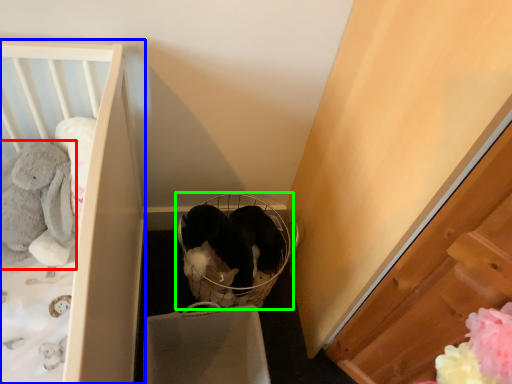
Question: Based on their relative distances, which object is farther from animal (highlighted by a red box)? Choose from furniture (highlighted by a blue box) and baby carriage (highlighted by a green box).

Choices:
 (A) furniture
 (B) baby carriage

Answer: (B)